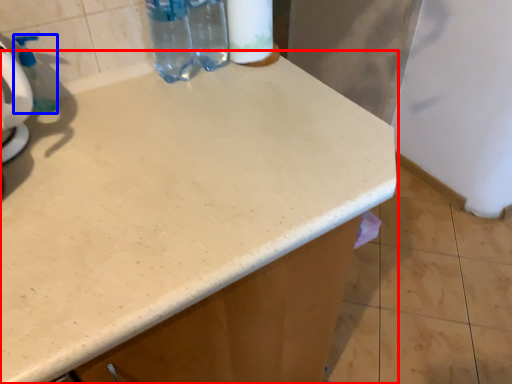
Question: Which of the following is the closest to the observer, countertop (highlighted by a red box) or soap dispenser (highlighted by a blue box)?

Choices:
 (A) countertop
 (B) soap dispenser

Answer: (A)